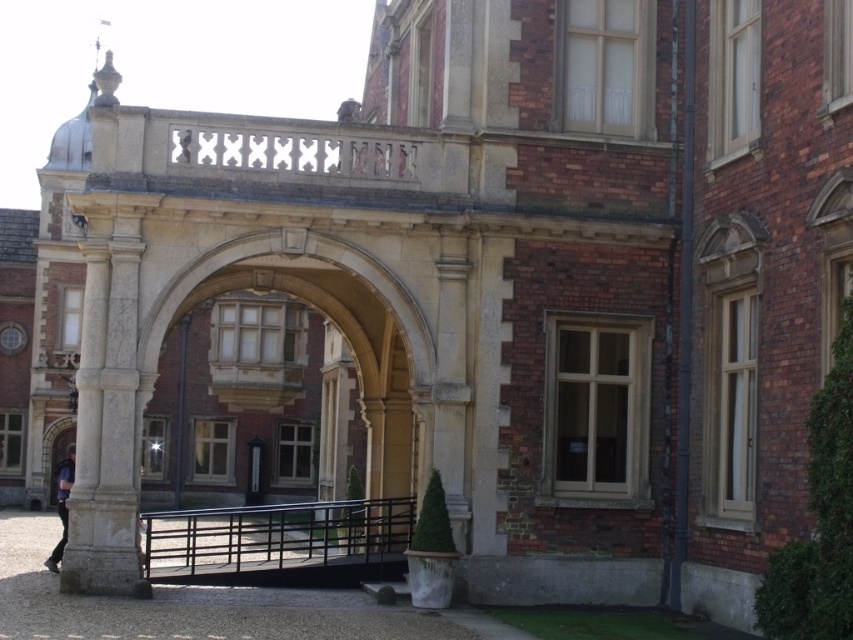
Question: Which object is the closest to the white marble column at left?

Choices:
 (A) smooth stone archway at center
 (B) blue fabric shirt at lower left

Answer: (B)

Question: Estimate the real-world distances between objects in this image. Which object is farther from the white marble column at left?

Choices:
 (A) smooth stone archway at center
 (B) blue fabric shirt at lower left
 (C) black metal/rail at center

Answer: (C)

Question: Is black metal/rail at center positioned at the back of blue fabric shirt at lower left?

Choices:
 (A) no
 (B) yes

Answer: (A)

Question: Can you confirm if smooth stone archway at center is positioned to the left of black metal/rail at center?

Choices:
 (A) yes
 (B) no

Answer: (B)

Question: From the image, what is the correct spatial relationship of smooth stone archway at center in relation to white marble column at left?

Choices:
 (A) above
 (B) below

Answer: (B)

Question: Which point appears farthest from the camera in this image?

Choices:
 (A) (93, 314)
 (B) (361, 500)
 (C) (53, 552)
 (D) (335, 456)

Answer: (D)